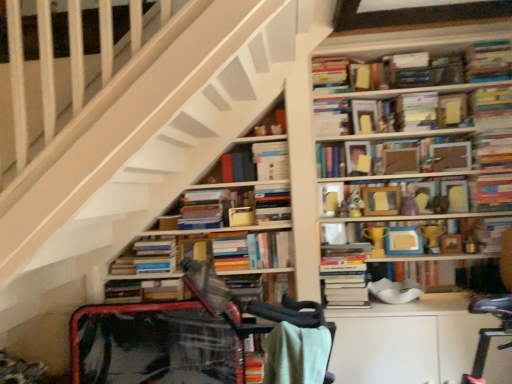
Describe the element at coordinates (329, 71) in the screenshot. I see `hardcover books at upper center, marked as the 15th book in a bottom-to-top arrangement` at that location.

Identify the location of wooden picture frame at upper center, the ninth book ordered from the bottom. pos(417,190).

The height and width of the screenshot is (384, 512). What do you see at coordinates (146, 290) in the screenshot? I see `hardcover books at lower left, which ranks as the sixteenth book in top-to-bottom order` at bounding box center [146, 290].

What is the approximate height of hardcover books at center, which is counted as the seventh book, starting from the bottom?

The height of hardcover books at center, which is counted as the seventh book, starting from the bottom, is 8.67 inches.

From the picture: Measure the distance between hardcover book at upper right, the 7th book from the top, and camera.

hardcover book at upper right, the 7th book from the top, is 7.64 feet away from camera.

Describe the element at coordinates (490, 193) in the screenshot. This screenshot has width=512, height=384. I see `hardcover book at upper right, the 7th book from the top` at that location.

Locate an element on the screen. hardcover book at upper right, arranged as the first book when viewed from the top is located at coordinates (489, 61).

Describe the element at coordinates (489, 61) in the screenshot. I see `hardcover book at upper right, the 16th book positioned from the bottom` at that location.

Locate an element on the screen. The image size is (512, 384). green cotton blanket at lower center is located at coordinates (296, 354).

Which is behind, point (323, 151) or point (355, 293)?

The point (323, 151) is farther.

Does hardcover book at upper center, the twelfth book when ordered from bottom to top, have a lesser height compared to hardcover books at center, which appears as the fourteenth book when viewed from the top?

Indeed, hardcover book at upper center, the twelfth book when ordered from bottom to top, has a lesser height compared to hardcover books at center, which appears as the fourteenth book when viewed from the top.

How distant is hardcover book at upper center, the twelfth book when ordered from bottom to top, from hardcover books at center, which appears as the fourteenth book when viewed from the top?

The distance of hardcover book at upper center, the twelfth book when ordered from bottom to top, from hardcover books at center, which appears as the fourteenth book when viewed from the top, is 23.63 inches.

Is hardcover book at upper center, the twelfth book when ordered from bottom to top, far away from hardcover books at center, which appears as the fourteenth book when viewed from the top?

No, hardcover book at upper center, the twelfth book when ordered from bottom to top, is in close proximity to hardcover books at center, which appears as the fourteenth book when viewed from the top.

Who is more distant, hardcover book at upper right, arranged as the first book when viewed from the top, or matte cardboard frame at upper center, which is the second paperback book in bottom-to-top order?

matte cardboard frame at upper center, which is the second paperback book in bottom-to-top order, is more distant.

Who is smaller, hardcover book at upper right, arranged as the first book when viewed from the top, or matte cardboard frame at upper center, arranged as the 5th paperback book when viewed from the top?

Smaller between the two is matte cardboard frame at upper center, arranged as the 5th paperback book when viewed from the top.

In the scene shown: How different are the orientations of hardcover book at upper right, arranged as the first book when viewed from the top, and matte cardboard frame at upper center, which is the second paperback book in bottom-to-top order, in degrees?

They differ by 1.28 degrees in their facing directions.

From the image's perspective, does hardcover books at center, the ninth book when ordered from top to bottom, appear lower than matte cardboard frame at upper center, which is the second paperback book in bottom-to-top order?

Yes, from the image's perspective, hardcover books at center, the ninth book when ordered from top to bottom, is beneath matte cardboard frame at upper center, which is the second paperback book in bottom-to-top order.

From a real-world perspective, starting from the hardcover books at center, marked as the eighth book in a bottom-to-top arrangement, which paperback book is the 2nd one vertically above it? Please provide its 2D coordinates.

[(400, 161)]

Which of these two, hardcover books at center, the ninth book when ordered from top to bottom, or matte cardboard frame at upper center, arranged as the 5th paperback book when viewed from the top, is smaller?

With smaller size is matte cardboard frame at upper center, arranged as the 5th paperback book when viewed from the top.

Considering the positions of objects hardcover books at center, marked as the eighth book in a bottom-to-top arrangement, and hardcover books at center, which is counted as the fifth book, starting from the bottom, in the image provided, who is more to the right, hardcover books at center, marked as the eighth book in a bottom-to-top arrangement, or hardcover books at center, which is counted as the fifth book, starting from the bottom,?

Positioned to the right is hardcover books at center, marked as the eighth book in a bottom-to-top arrangement.

Is hardcover books at center, the ninth book when ordered from top to bottom, next to hardcover books at center, the 12th book when ordered from top to bottom, and touching it?

No, hardcover books at center, the ninth book when ordered from top to bottom, is not making contact with hardcover books at center, the 12th book when ordered from top to bottom.

Is hardcover books at center, marked as the eighth book in a bottom-to-top arrangement, outside of hardcover books at center, the 12th book when ordered from top to bottom?

Yes, hardcover books at center, marked as the eighth book in a bottom-to-top arrangement, is located beyond the bounds of hardcover books at center, the 12th book when ordered from top to bottom.

In terms of width, does hardcover books at center, the ninth book when ordered from top to bottom, look wider or thinner when compared to hardcover books at center, the 12th book when ordered from top to bottom?

Considering their sizes, hardcover books at center, the ninth book when ordered from top to bottom, looks broader than hardcover books at center, the 12th book when ordered from top to bottom.

From a real-world perspective, is green cotton blanket at lower center physically above hardcover books at center, the ninth book when ordered from top to bottom?

No.

Is green cotton blanket at lower center in front of or behind hardcover books at center, the ninth book when ordered from top to bottom, in the image?

Clearly, green cotton blanket at lower center is in front of hardcover books at center, the ninth book when ordered from top to bottom.

Which point is more forward, (328, 349) or (283, 201)?

The point (328, 349) is more forward.

How many degrees apart are the facing directions of hardcover books at upper center, which ranks as the 11th book in bottom-to-top order, and matte yellow trophy at center, the sixth book ordered from the bottom?

They differ by 2.09 degrees in their facing directions.

Is hardcover books at upper center, which ranks as the 11th book in bottom-to-top order, closer to the viewer compared to matte yellow trophy at center, the eleventh book positioned from the top?

Yes, hardcover books at upper center, which ranks as the 11th book in bottom-to-top order, is closer to the viewer.

From the matte yellow trophy at center, the eleventh book positioned from the top, count the 7th book to the left and point to it. Please provide its 2D coordinates.

[(241, 163)]

From the image's perspective, which is below, hardcover books at upper center, which ranks as the 11th book in bottom-to-top order, or matte yellow trophy at center, the sixth book ordered from the bottom?

matte yellow trophy at center, the sixth book ordered from the bottom.

From the image's perspective, is hardcover book at upper right, marked as the fifth paperback book in a bottom-to-top arrangement, located above or below hardcover books at center, the 12th book when ordered from top to bottom?

Clearly, from the image's perspective, hardcover book at upper right, marked as the fifth paperback book in a bottom-to-top arrangement, is above hardcover books at center, the 12th book when ordered from top to bottom.

From the picture: Is there a large distance between hardcover book at upper right, marked as the second paperback book in a top-to-bottom arrangement, and hardcover books at center, the 12th book when ordered from top to bottom?

No, there isn't a large distance between hardcover book at upper right, marked as the second paperback book in a top-to-bottom arrangement, and hardcover books at center, the 12th book when ordered from top to bottom.

Choose the correct answer: Is hardcover book at upper right, marked as the fifth paperback book in a bottom-to-top arrangement, inside hardcover books at center, which is counted as the fifth book, starting from the bottom, or outside it?

hardcover book at upper right, marked as the fifth paperback book in a bottom-to-top arrangement, is spatially situated outside hardcover books at center, which is counted as the fifth book, starting from the bottom.

Looking at this image, is hardcover book at upper right, marked as the second paperback book in a top-to-bottom arrangement, turned away from hardcover books at center, the 12th book when ordered from top to bottom?

No, hardcover book at upper right, marked as the second paperback book in a top-to-bottom arrangement,'s orientation is not away from hardcover books at center, the 12th book when ordered from top to bottom.

Identify the location of the 9th book above the hardcover books at center, which appears as the fourteenth book when viewed from the top (from the image's perspective). (330, 161).

This screenshot has width=512, height=384. What are the coordinates of `the 7th book in front of the matte cardboard frame at upper center, arranged as the 5th paperback book when viewed from the top, starting your count from the anchor` in the screenshot? It's located at (489, 61).

Estimate the real-world distances between objects in this image. Which object is further from hardcover books at center, which is counted as the fifth book, starting from the bottom, white paper book at upper center, marked as the third book in a top-to-bottom arrangement, or hardcover book at upper right, marked as the second paperback book in a top-to-bottom arrangement?

Among the two, hardcover book at upper right, marked as the second paperback book in a top-to-bottom arrangement, is located further to hardcover books at center, which is counted as the fifth book, starting from the bottom.

Estimate the real-world distances between objects in this image. Which object is further from matte paper book at upper right, the sixth paperback book positioned from the bottom, hardcover book at upper right, marked as the fifth paperback book in a bottom-to-top arrangement, or hardcover book at upper right, arranged as the first book when viewed from the top?

The object further to matte paper book at upper right, the sixth paperback book positioned from the bottom, is hardcover book at upper right, arranged as the first book when viewed from the top.

When comparing their distances from hardcover book at upper right, placed as the fourth paperback book when sorted from bottom to top, does matte cardboard frame at upper center, arranged as the 5th paperback book when viewed from the top, or hardcover books at upper center, acting as the 2th book starting from the top, seem further?

hardcover books at upper center, acting as the 2th book starting from the top, lies further to hardcover book at upper right, placed as the fourth paperback book when sorted from bottom to top, than the other object.

Considering their positions, is matte cardboard frame at upper center, which is the second paperback book in bottom-to-top order, positioned closer to yellow matte paper at upper center, which is the fourth paperback book in top-to-bottom order, than hardcover books at center, which is counted as the fifth book, starting from the bottom?

matte cardboard frame at upper center, which is the second paperback book in bottom-to-top order, is positioned closer to the anchor yellow matte paper at upper center, which is the fourth paperback book in top-to-bottom order.

Considering their positions, is matte wooden frame at upper center, the 1th paperback book ordered from the bottom, positioned further to hardcover books at center, marked as the tenth book in a top-to-bottom arrangement, than green cotton blanket at lower center?

Among the two, green cotton blanket at lower center is located further to hardcover books at center, marked as the tenth book in a top-to-bottom arrangement.

From the image, which object appears to be farther from hardcover book at upper right, which is the tenth book in bottom-to-top order, hardcover books at center, which is counted as the seventh book, starting from the bottom, or hardcover books at upper center, the 6th book positioned from the top?

hardcover books at center, which is counted as the seventh book, starting from the bottom, lies further to hardcover book at upper right, which is the tenth book in bottom-to-top order, than the other object.

When comparing their distances from hardcover books at lower left, which ranks as the sixteenth book in top-to-bottom order, does matte wooden frame at upper center, the 1th paperback book ordered from the bottom, or hardcover books at center, the 3th book in the bottom-to-top sequence, seem further?

matte wooden frame at upper center, the 1th paperback book ordered from the bottom, is further to hardcover books at lower left, which ranks as the sixteenth book in top-to-bottom order.

Based on their spatial positions, is matte wooden frame at upper center, which is counted as the sixth paperback book, starting from the top, or matte yellow trophy at center, the eleventh book positioned from the top, further from hardcover book at upper center, positioned as the 5th book in top-to-bottom order?

matte yellow trophy at center, the eleventh book positioned from the top, is positioned further to the anchor hardcover book at upper center, positioned as the 5th book in top-to-bottom order.

This screenshot has width=512, height=384. Identify the location of blanket between hardcover books at lower left, which ranks as the sixteenth book in top-to-bottom order, and matte yellow trophy at center, the sixth book ordered from the bottom, from left to right. (296, 354).

The width and height of the screenshot is (512, 384). I want to click on book located between hardcover books at center, which appears as the fourteenth book when viewed from the top, and matte yellow trophy at center, the sixth book ordered from the bottom, in the left-right direction, so click(417, 190).

Identify the location of blanket between hardcover books at lower left, the thirteenth book in the top-to-bottom sequence, and matte yellow trophy at center, the sixth book ordered from the bottom, in the horizontal direction. Image resolution: width=512 pixels, height=384 pixels. (296, 354).

Locate an element on the screen. paperback book between yellow matte paper at upper center, which ranks as the third paperback book in bottom-to-top order, and matte wooden frame at upper center, the 1th paperback book ordered from the bottom, from top to bottom is located at coordinates (400, 161).